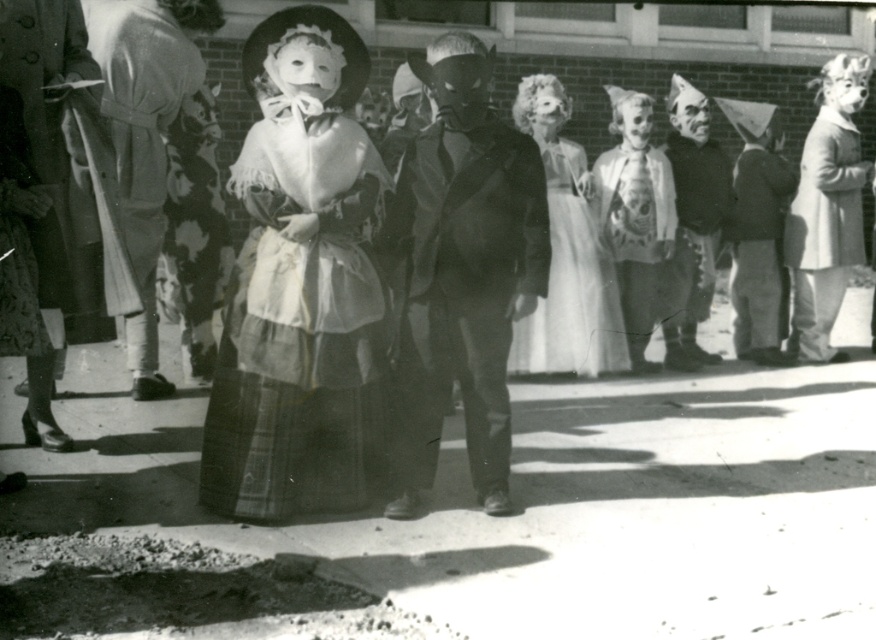
At what (x,y) coordinates should I click in order to perform the action: click on smooth beige coat at right. Please return your answer as a coordinate pair (x, y). Looking at the image, I should click on (825, 209).

Does smooth beige coat at right have a larger size compared to light beige wool coat at right?

Yes.

This screenshot has width=876, height=640. Describe the element at coordinates (825, 209) in the screenshot. I see `smooth beige coat at right` at that location.

This screenshot has height=640, width=876. What are the coordinates of `smooth beige coat at right` in the screenshot? It's located at (825, 209).

Is matte floral dress at center bigger than plaid wool dress at left?

Indeed, matte floral dress at center has a larger size compared to plaid wool dress at left.

Is matte floral dress at center to the right of plaid wool dress at left from the viewer's perspective?

Correct, you'll find matte floral dress at center to the right of plaid wool dress at left.

Who is more distant from viewer, [147,278] or [34,216]?

Point [147,278]

This screenshot has width=876, height=640. Find the location of `matte floral dress at center`. matte floral dress at center is located at coordinates 154,141.

Between smooth black suit at center and matte brown paper bag at center, which one is positioned lower?

smooth black suit at center is lower down.

Is smooth black suit at center bigger than matte brown paper bag at center?

Correct, smooth black suit at center is larger in size than matte brown paper bag at center.

What are the coordinates of `smooth black suit at center` in the screenshot? It's located at (467, 273).

I want to click on smooth black suit at center, so click(x=467, y=273).